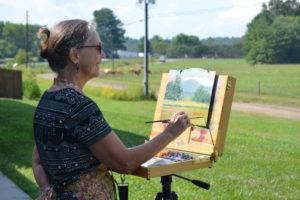
Locate an element on the screen. The height and width of the screenshot is (200, 300). handle is located at coordinates (199, 182).